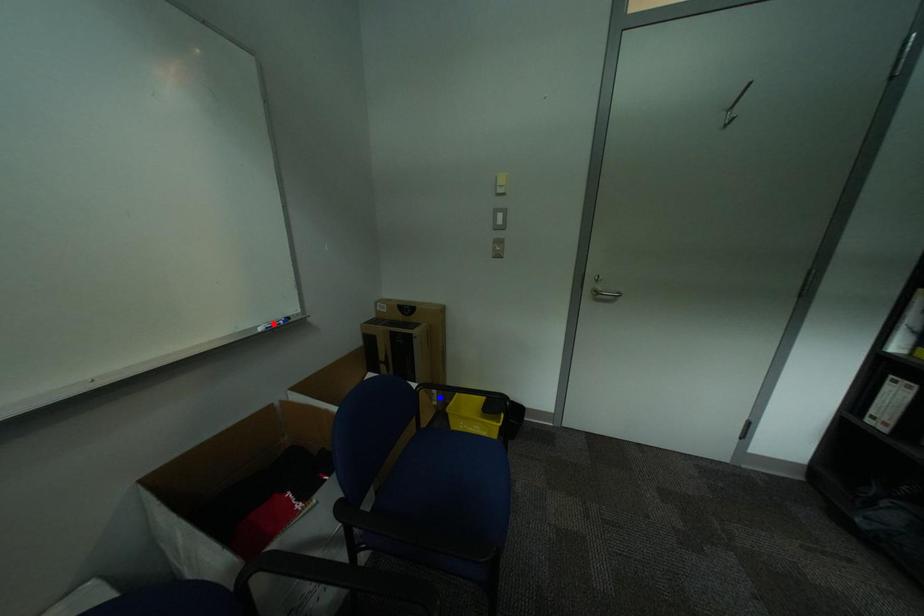
Question: Which of the two points in the image is closer to the camera?

Choices:
 (A) Blue point is closer.
 (B) Red point is closer.

Answer: (B)